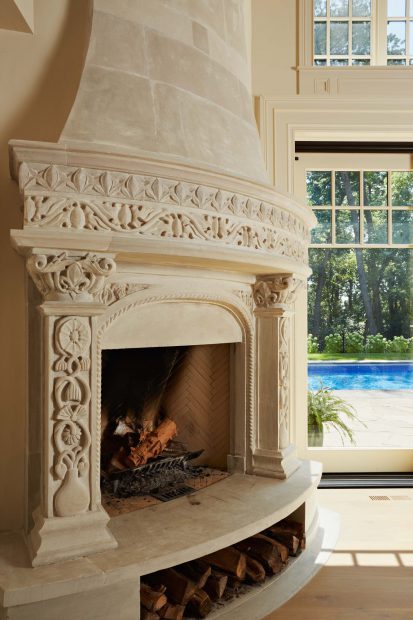
In order to click on glass door in this screenshot , I will do `click(329, 303)`, `click(394, 314)`, `click(333, 370)`, `click(386, 383)`, `click(399, 432)`, `click(337, 428)`.